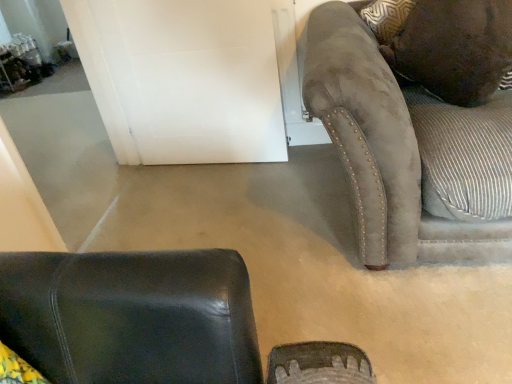
Question: Is brown suede pillow at upper right at the right side of suede couch at right?

Choices:
 (A) yes
 (B) no

Answer: (B)

Question: Considering the relative sizes of brown suede pillow at upper right and suede couch at right in the image provided, is brown suede pillow at upper right thinner than suede couch at right?

Choices:
 (A) no
 (B) yes

Answer: (B)

Question: From a real-world perspective, is brown suede pillow at upper right below suede couch at right?

Choices:
 (A) no
 (B) yes

Answer: (A)

Question: Is the position of brown suede pillow at upper right less distant than that of suede couch at right?

Choices:
 (A) yes
 (B) no

Answer: (B)

Question: Does brown suede pillow at upper right touch suede couch at right?

Choices:
 (A) no
 (B) yes

Answer: (A)

Question: Is the position of brown suede pillow at upper right more distant than that of suede couch at right?

Choices:
 (A) yes
 (B) no

Answer: (A)

Question: Is white matte door at upper center inside brown suede pillow at upper right?

Choices:
 (A) yes
 (B) no

Answer: (B)

Question: Does brown suede pillow at upper right have a smaller size compared to white matte door at upper center?

Choices:
 (A) yes
 (B) no

Answer: (B)

Question: Does brown suede pillow at upper right touch white matte door at upper center?

Choices:
 (A) no
 (B) yes

Answer: (A)

Question: From a real-world perspective, does brown suede pillow at upper right sit lower than white matte door at upper center?

Choices:
 (A) yes
 (B) no

Answer: (B)

Question: Is brown suede pillow at upper right oriented away from white matte door at upper center?

Choices:
 (A) yes
 (B) no

Answer: (B)

Question: From the image's perspective, is brown suede pillow at upper right located beneath white matte door at upper center?

Choices:
 (A) no
 (B) yes

Answer: (B)

Question: From the image's perspective, is white matte door at upper center located above brown suede pillow at upper right?

Choices:
 (A) no
 (B) yes

Answer: (B)